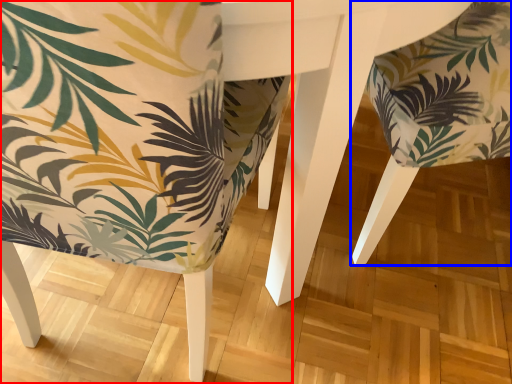
Question: Which object appears farthest to the camera in this image, chair (highlighted by a red box) or chair (highlighted by a blue box)?

Choices:
 (A) chair
 (B) chair

Answer: (B)